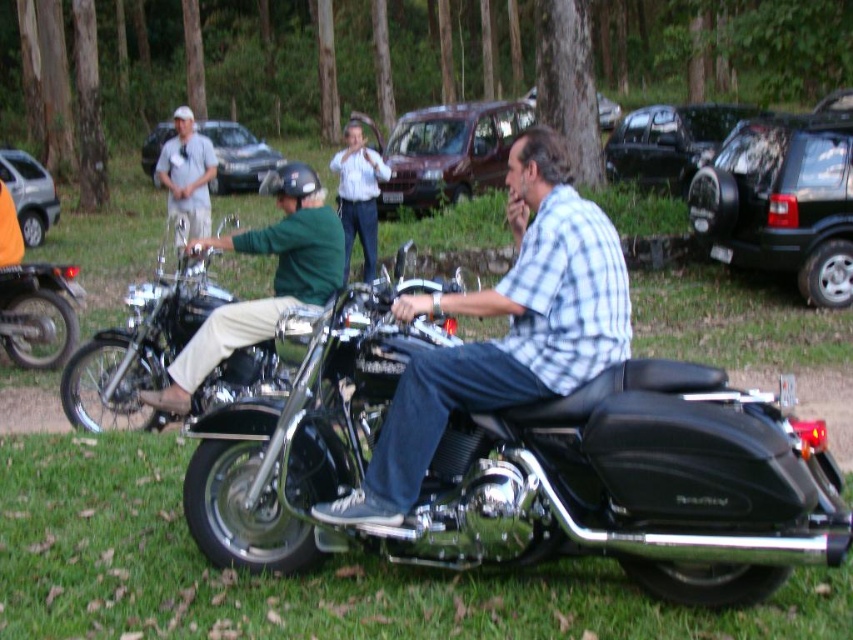
Question: Which object is closer to the camera taking this photo?

Choices:
 (A) checkered fabric shirt at center
 (B) green fabric shirt at center

Answer: (A)

Question: Which of these objects is positioned farthest from the dark green matte suv at right?

Choices:
 (A) matte silver suv at upper center
 (B) shiny chrome motorcycle at left
 (C) green grass at lower center

Answer: (A)

Question: Considering the relative positions of green fabric shirt at center and silver metallic suv at left in the image provided, where is green fabric shirt at center located with respect to silver metallic suv at left?

Choices:
 (A) above
 (B) below

Answer: (B)

Question: Is the position of matte silver suv at upper center more distant than that of metallic silver suv at center?

Choices:
 (A) no
 (B) yes

Answer: (A)

Question: Does green fabric shirt at center have a lesser width compared to silver metallic suv at left?

Choices:
 (A) no
 (B) yes

Answer: (A)

Question: Estimate the real-world distances between objects in this image. Which object is closer to the metallic silver suv at center?

Choices:
 (A) green fabric shirt at center
 (B) checkered fabric shirt at center
 (C) white matte cap at upper left
 (D) shiny chrome motorcycle at left

Answer: (D)